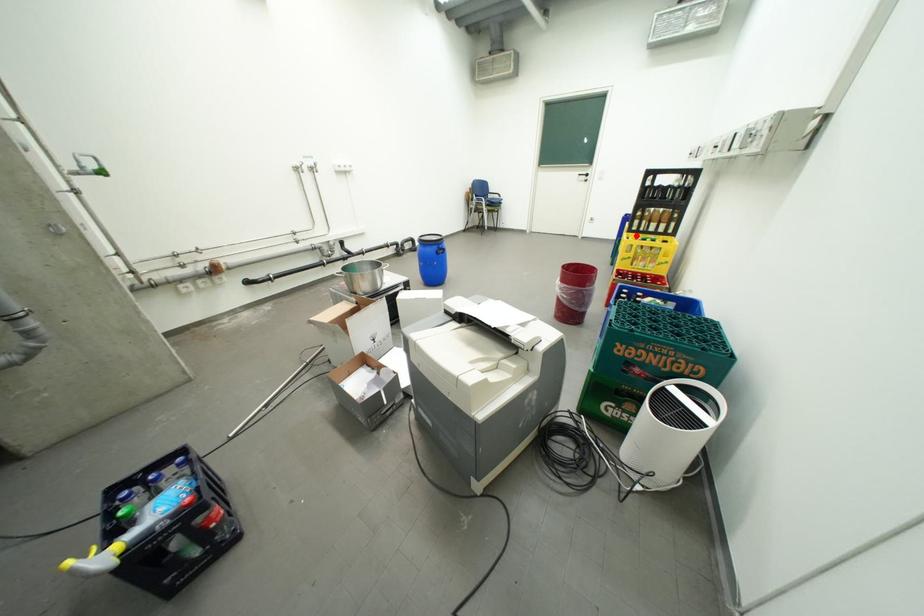
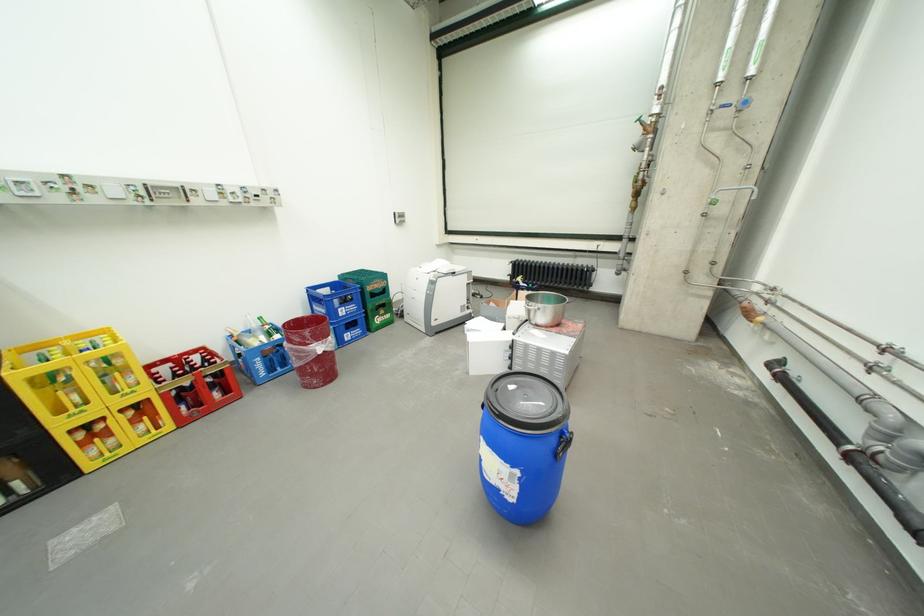
Question: I am providing you with two images of the same scene from different viewpoints. In image1, a red point is highlighted. Considering the same 3D point in image2, which of the following is correct?

Choices:
 (A) It is closer
 (B) It is farther

Answer: (B)